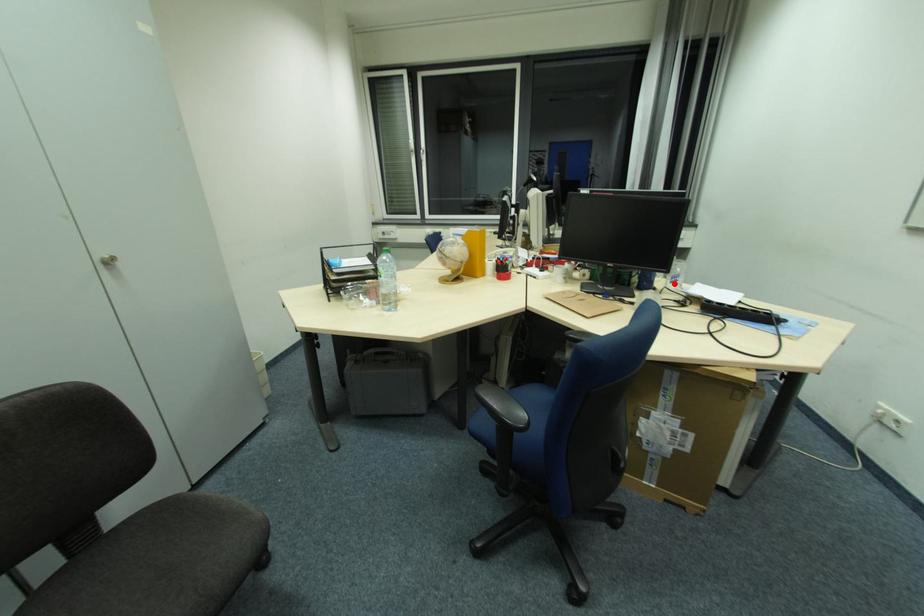
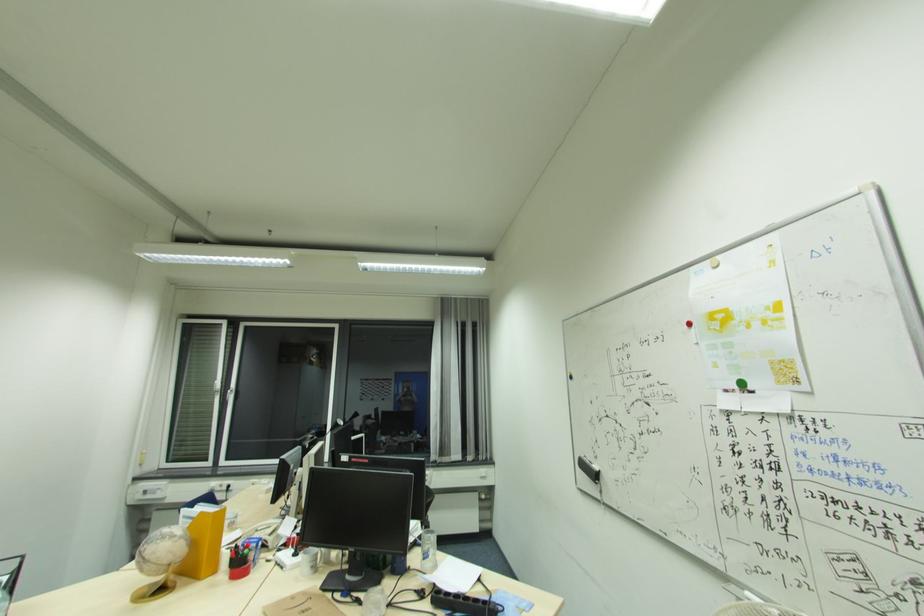
Question: I am providing you with two images of the same scene from different viewpoints. In image1, a red point is highlighted. Considering the same 3D point in image2, which of the following is correct?

Choices:
 (A) It is closer
 (B) It is farther

Answer: (B)